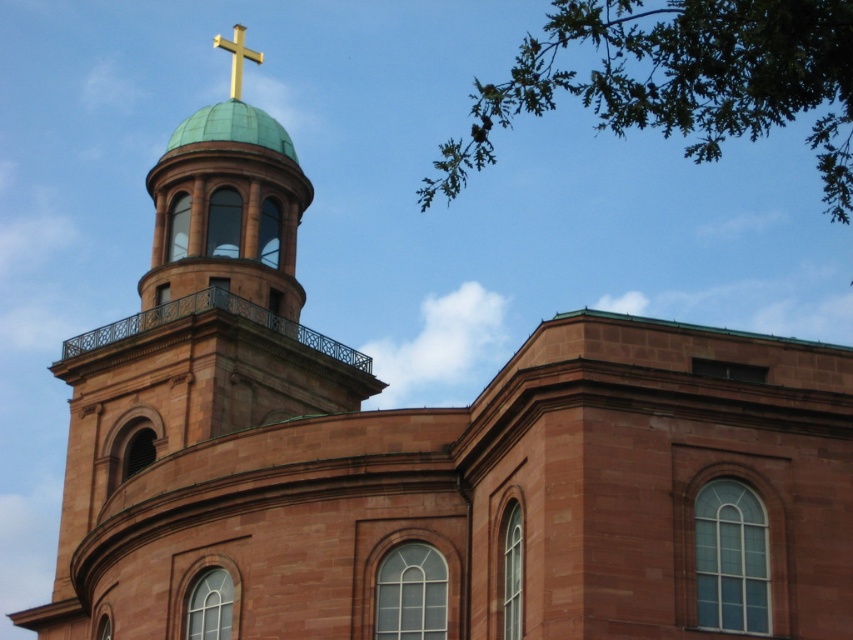
You are an architect analyzing the church building. You notice the green leafy branch at upper right and the gold metallic cross at top. Which object is closer to the ground?

The green leafy branch at upper right is positioned under the gold metallic cross at top, so it is closer to the ground than the cross.

You are an architect designing a new church. You want to ensure that the green leafy branch at upper right and the gold metallic cross at top are visible from the front entrance. Considering their sizes, which one will appear bigger to someone standing at the entrance?

The green leafy branch at upper right is larger in size than the gold metallic cross at top, so it will appear bigger to someone standing at the entrance.

You are an architect designing a new church. You want to ensure that the green leafy branch at upper right and the gold metallic cross at top are visible from the front entrance. Which object should you make wider to maintain their visibility?

The green leafy branch at upper right is already wider than the gold metallic cross at top, so to maintain visibility, you should keep the green leafy branch at upper right at its current width or make the gold metallic cross at top narrower.